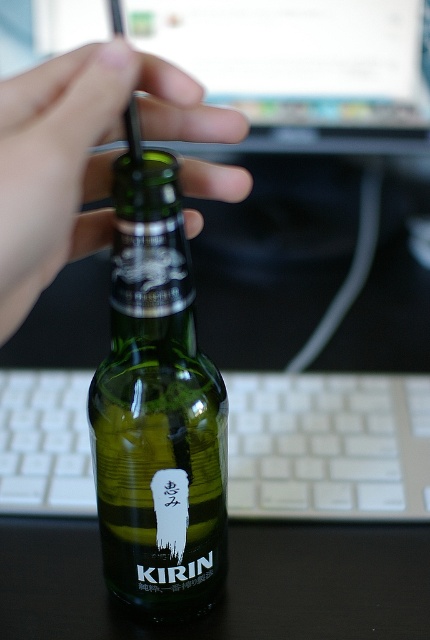
Is green glass bottle at center smaller than white plastic keyboard at lower center?

Yes.

Is green glass bottle at center to the left of white plastic keyboard at lower center from the viewer's perspective?

Yes, green glass bottle at center is to the left of white plastic keyboard at lower center.

Is point (147, 438) closer to camera compared to point (263, 499)?

That is True.

Find the location of a particular element. The image size is (430, 640). green glass bottle at center is located at coordinates (157, 410).

Looking at this image, can you confirm if white plastic keyboard at lower center is positioned above green matte bottle cap at center?

No, white plastic keyboard at lower center is not above green matte bottle cap at center.

Find the location of `white plastic keyboard at lower center`. white plastic keyboard at lower center is located at coordinates (328, 445).

Find the location of a particular element. Image resolution: width=430 pixels, height=640 pixels. white plastic keyboard at lower center is located at coordinates [x=328, y=445].

Does green glass bottle at center have a greater width compared to green matte bottle cap at center?

Incorrect, green glass bottle at center's width does not surpass green matte bottle cap at center's.

How far apart are green glass bottle at center and green matte bottle cap at center?

green glass bottle at center and green matte bottle cap at center are 3.83 inches apart from each other.

In the scene shown: Measure the distance between point (119,595) and camera.

A distance of 19.65 inches exists between point (119,595) and camera.

The width and height of the screenshot is (430, 640). In order to click on green glass bottle at center in this screenshot , I will do `click(157, 410)`.